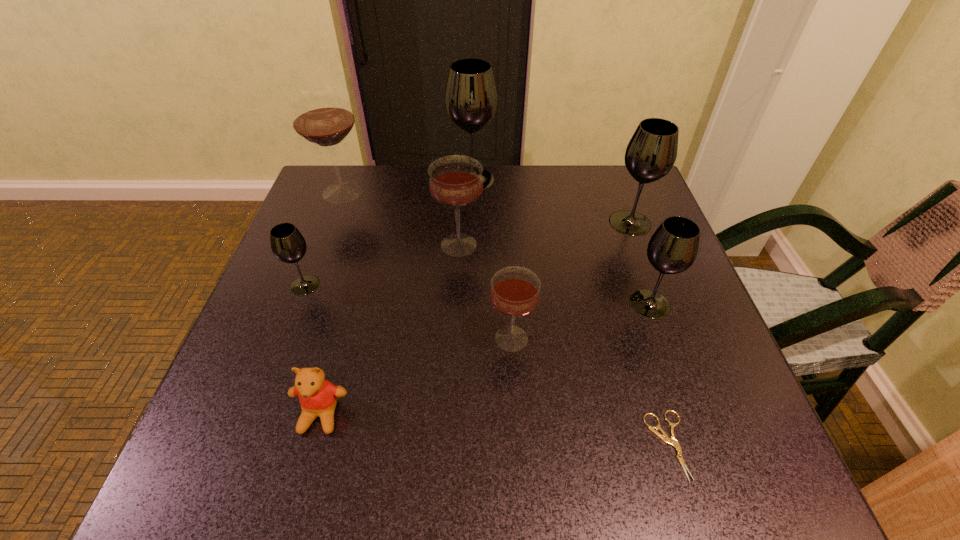
Find the location of a particular element. Image resolution: width=960 pixels, height=540 pixels. the smallest gray wineglass is located at coordinates (288, 245).

Where is `teddy bear`? teddy bear is located at coordinates (318, 397).

Identify the location of red teddy bear. The image size is (960, 540). (318, 397).

Identify the location of shears. tap(672, 441).

The height and width of the screenshot is (540, 960). I want to click on the shortest object, so pyautogui.click(x=672, y=441).

Locate an element on the screen. The height and width of the screenshot is (540, 960). vacant space located on the left of the farthest gray wineglass is located at coordinates (338, 179).

Identify the location of vacant space situated 0.110m on the right of the farthest red wineglass. The height and width of the screenshot is (540, 960). coord(411,192).

This screenshot has width=960, height=540. What are the coordinates of `vacant region located on the front of the third smallest gray wineglass` in the screenshot? It's located at pyautogui.click(x=656, y=293).

Find the location of a particular element. This screenshot has height=540, width=960. free space located on the front of the second nearest red wineglass is located at coordinates (x=449, y=426).

Image resolution: width=960 pixels, height=540 pixels. Find the location of `free spot located 0.400m on the left of the third biggest gray wineglass`. free spot located 0.400m on the left of the third biggest gray wineglass is located at coordinates (436, 303).